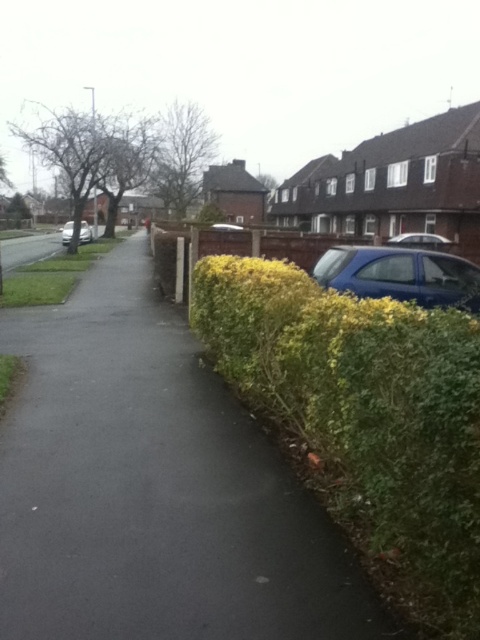
Question: Can you confirm if green leafy hedge at center is wider than blue matte car at right?

Choices:
 (A) yes
 (B) no

Answer: (B)

Question: Among these points, which one is farthest from the camera?

Choices:
 (A) (196, 262)
 (B) (400, 240)
 (C) (385, 292)
 (D) (84, 428)

Answer: (B)

Question: Can you confirm if black asphalt pavement at center is positioned above white matte car at right?

Choices:
 (A) yes
 (B) no

Answer: (B)

Question: Which of the following is the farthest from the observer?

Choices:
 (A) (385, 289)
 (B) (92, 232)

Answer: (B)

Question: Considering the real-world distances, which object is farthest from the white matte car at right?

Choices:
 (A) blue matte car at right
 (B) matte black car at center

Answer: (B)

Question: Is blue matte car at right wider than white matte car at right?

Choices:
 (A) no
 (B) yes

Answer: (A)